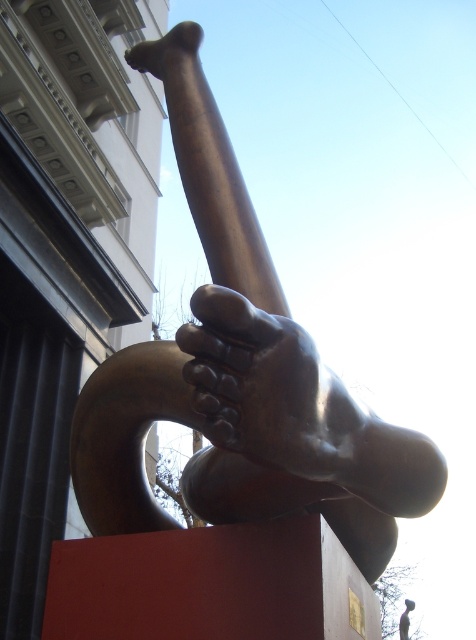
Between bronze sculpture at center and bronze/smooth hand at center, which one appears on the left side from the viewer's perspective?

From the viewer's perspective, bronze/smooth hand at center appears more on the left side.

Between point (244, 413) and point (231, 305), which one is positioned behind?

The point (244, 413) is more distant.

Between point (385, 512) and point (232, 330), which one is positioned in front?

Point (232, 330) is more forward.

Where is `bronze sculpture at center`? Image resolution: width=476 pixels, height=640 pixels. bronze sculpture at center is located at coordinates (243, 390).

What are the coordinates of `bronze/smooth hand at center` in the screenshot? It's located at (256, 381).

Who is more forward, (x=285, y=454) or (x=151, y=61)?

Point (x=285, y=454)

Identify the location of bronze/smooth hand at center. (256, 381).

Can you confirm if bronze sculpture at center is positioned to the right of bronze shiny hand at upper center?

Indeed, bronze sculpture at center is positioned on the right side of bronze shiny hand at upper center.

Locate an element on the screen. bronze sculpture at center is located at coordinates (243, 390).